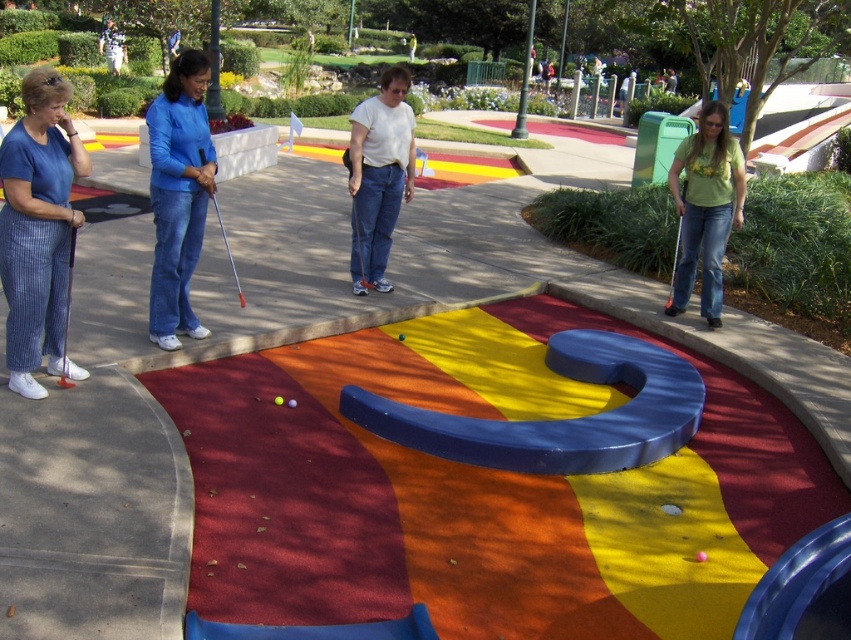
Question: Observing the image, what is the correct spatial positioning of green matte golf club at right in reference to pink matte golf ball at center?

Choices:
 (A) right
 (B) left

Answer: (A)

Question: Estimate the real-world distances between objects in this image. Which object is closer to the blue pinstriped pants at left?

Choices:
 (A) matte blue shirt at center
 (B) matte black golf club at lower left

Answer: (B)

Question: Does matte black golf club at lower left have a larger size compared to green matte golf club at right?

Choices:
 (A) yes
 (B) no

Answer: (B)

Question: Which of the following is the closest to the observer?

Choices:
 (A) (164, 243)
 (B) (63, 332)
 (C) (672, 163)

Answer: (B)

Question: Does rubberized carpet at center have a lesser width compared to yellow matte golf ball at center?

Choices:
 (A) yes
 (B) no

Answer: (B)

Question: Which of the following is the farthest from the observer?

Choices:
 (A) rubberized carpet at center
 (B) matte black golf club at lower left
 (C) green matte shirt at right
 (D) blue pinstriped pants at left

Answer: (C)